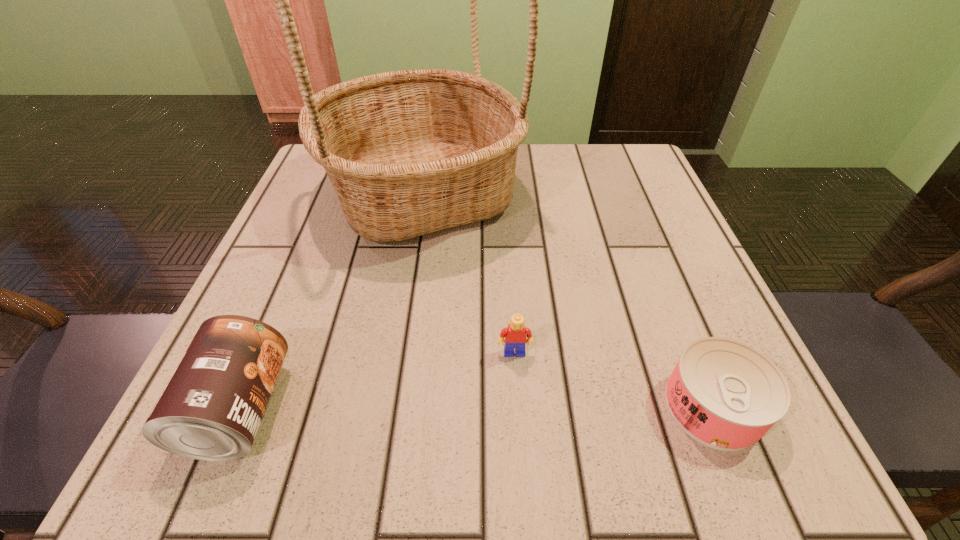
Where is `vacant space located 0.130m on the face of the second shortest object`? This screenshot has height=540, width=960. vacant space located 0.130m on the face of the second shortest object is located at coordinates (521, 447).

I want to click on free space located on the left of the shortest object, so click(x=386, y=406).

The height and width of the screenshot is (540, 960). Find the location of `object situated at the far edge`. object situated at the far edge is located at coordinates (411, 152).

Image resolution: width=960 pixels, height=540 pixels. What are the coordinates of `basket situated at the left edge` in the screenshot? It's located at (411, 152).

At what (x,y) coordinates should I click in order to perform the action: click on can at the left edge. Please return your answer as a coordinate pair (x, y). The height and width of the screenshot is (540, 960). Looking at the image, I should click on (211, 409).

At what (x,y) coordinates should I click in order to perform the action: click on object located in the right edge section of the desktop. Please return your answer as a coordinate pair (x, y). The image size is (960, 540). Looking at the image, I should click on (725, 394).

Image resolution: width=960 pixels, height=540 pixels. In order to click on object that is at the far left corner in this screenshot , I will do `click(411, 152)`.

This screenshot has height=540, width=960. I want to click on object that is at the near left corner, so click(211, 409).

I want to click on object situated at the near right corner, so click(x=725, y=394).

Find the location of a particular element. The width and height of the screenshot is (960, 540). vacant space at the far edge of the desktop is located at coordinates (517, 172).